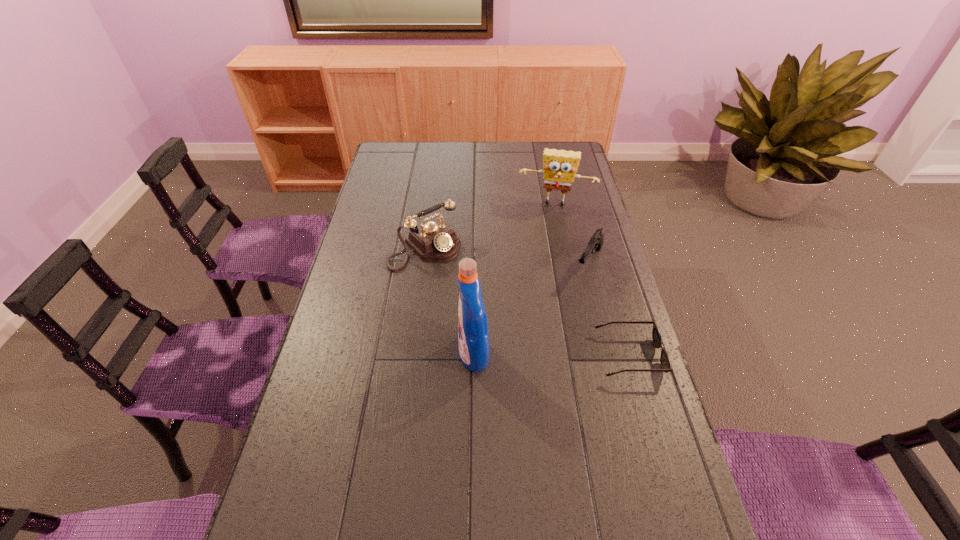
Locate an element on the screen. object that is the third nearest to the leftmost object is located at coordinates (596, 242).

Point out which object is positioned as the third nearest to the fourth tallest object. Please provide its 2D coordinates. Your answer should be formatted as a tuple, i.e. [(x, y)], where the tuple contains the x and y coordinates of a point satisfying the conditions above.

[(473, 337)]

Find the location of `free space that satisfies the following two spatial constraints: 1. on the front side of the fourth tallest object; 2. on the front lenses of the shortest object`. free space that satisfies the following two spatial constraints: 1. on the front side of the fourth tallest object; 2. on the front lenses of the shortest object is located at coordinates (612, 356).

I want to click on vacant space that satisfies the following two spatial constraints: 1. on the front side of the fourth tallest object; 2. on the front lenses of the shortest object, so click(x=612, y=356).

Where is `free spot that satisfies the following two spatial constraints: 1. on the front side of the tallest object; 2. on the label of the third shortest object`? This screenshot has height=540, width=960. free spot that satisfies the following two spatial constraints: 1. on the front side of the tallest object; 2. on the label of the third shortest object is located at coordinates (411, 355).